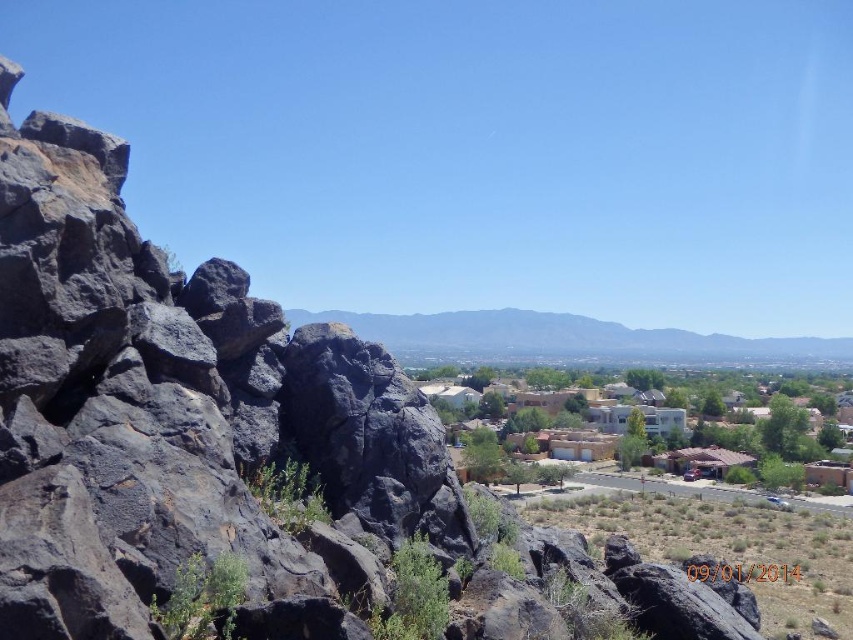
Based on the photo, you are a drone operator who needs to fly a drone from the gray rock formation at center to the adobe houses at center. Based on the scene description, will the drone have to ascend or descend to reach its destination?

The adobe houses at center is not as tall as gray rock formation at center, so the drone will have to descend to reach the adobe houses at center from the gray rock formation at center.

You are standing at the vantage point overlooking the suburban area. You need to locate the adobe houses at center. Based on their coordinates, which direction should you look to find them?

The adobe houses at center are located at coordinates point (683, 440), which means they are positioned towards the lower right of the image from your vantage point.

You are a delivery drone that needs to fly between the adobe houses at center and the gray rock formation at center. Which one has a smaller width, requiring you to adjust your flight path accordingly?

The adobe houses at center has a lesser width compared to gray rock formation at center, so you should adjust your flight path to navigate through the narrower space of the adobe houses at center.